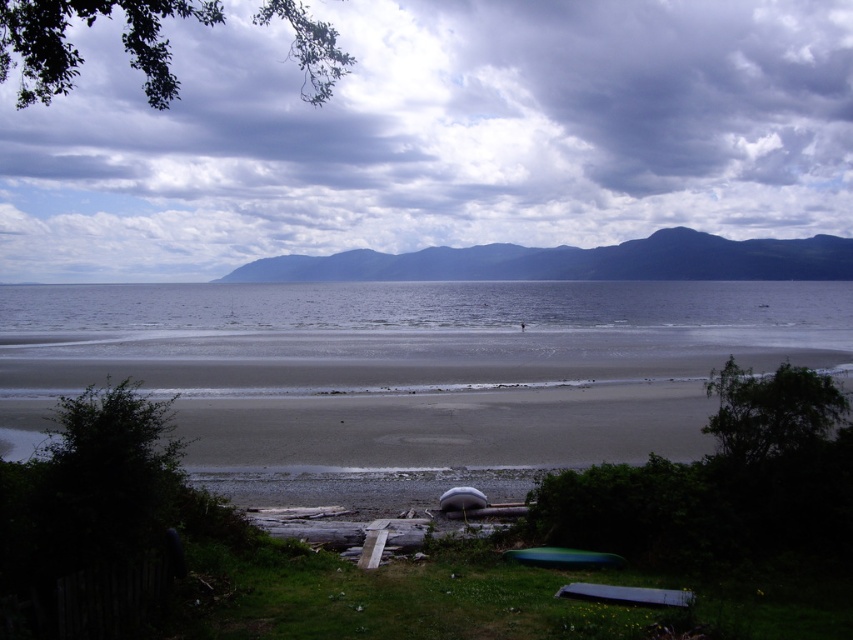
You are a hiker standing on the beach looking towards the mountains. You see the cloudy sky at upper center and the dark green forested mountain at upper center. Which object is closer to you?

The cloudy sky at upper center is further to the viewer than the dark green forested mountain at upper center, so the dark green forested mountain at upper center is closer to you.

You are a photographer planning to take a landscape photo of the cloudy sky at upper center and the dark green forested mountain at upper center. Based on the scene, which object is positioned to the left side of the other?

The cloudy sky at upper center is positioned to the left of the dark green forested mountain at upper center.